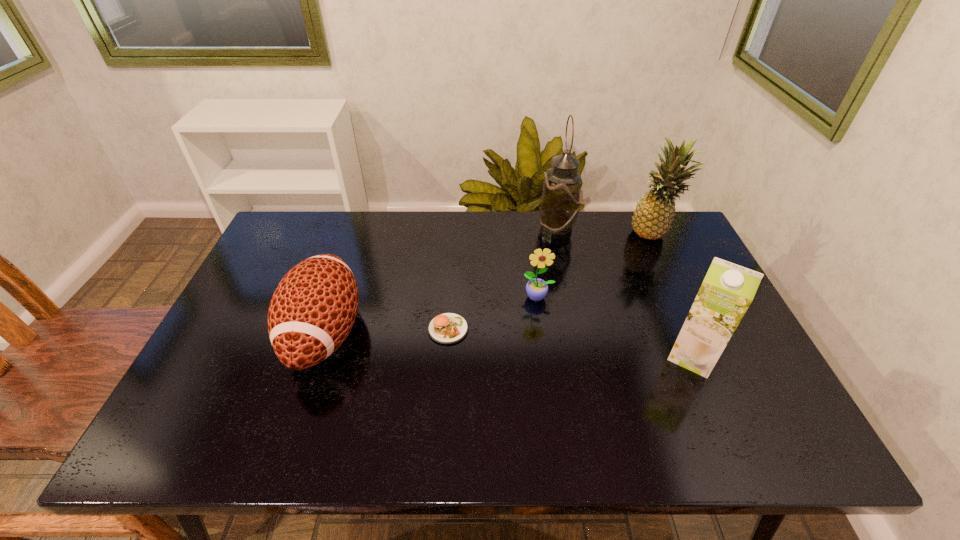
This screenshot has height=540, width=960. I want to click on free spot at the left edge of the desktop, so click(x=247, y=415).

At what (x,y) coordinates should I click in order to perform the action: click on blank space at the far left corner of the desktop. Please return your answer as a coordinate pair (x, y). Looking at the image, I should click on (313, 242).

I want to click on free area in between the soya milk and the oil lamp, so click(624, 293).

Locate an element on the screen. empty space that is in between the soya milk and the pineapple is located at coordinates (672, 295).

Find the location of a particular element. This screenshot has width=960, height=540. free space between the patty and the soya milk is located at coordinates (570, 342).

This screenshot has width=960, height=540. Find the location of `empty location between the oil lamp and the soya milk`. empty location between the oil lamp and the soya milk is located at coordinates (624, 293).

Where is `free space between the pineapple and the oil lamp`? Image resolution: width=960 pixels, height=540 pixels. free space between the pineapple and the oil lamp is located at coordinates (605, 232).

At what (x,y) coordinates should I click in order to perform the action: click on vacant area that lies between the leftmost object and the sunflower. Please return your answer as a coordinate pair (x, y). Looking at the image, I should click on (431, 315).

The image size is (960, 540). I want to click on free space between the leftmost object and the oil lamp, so click(441, 282).

Where is `vacant space in between the oil lamp and the soya milk`? The width and height of the screenshot is (960, 540). vacant space in between the oil lamp and the soya milk is located at coordinates coord(624,293).